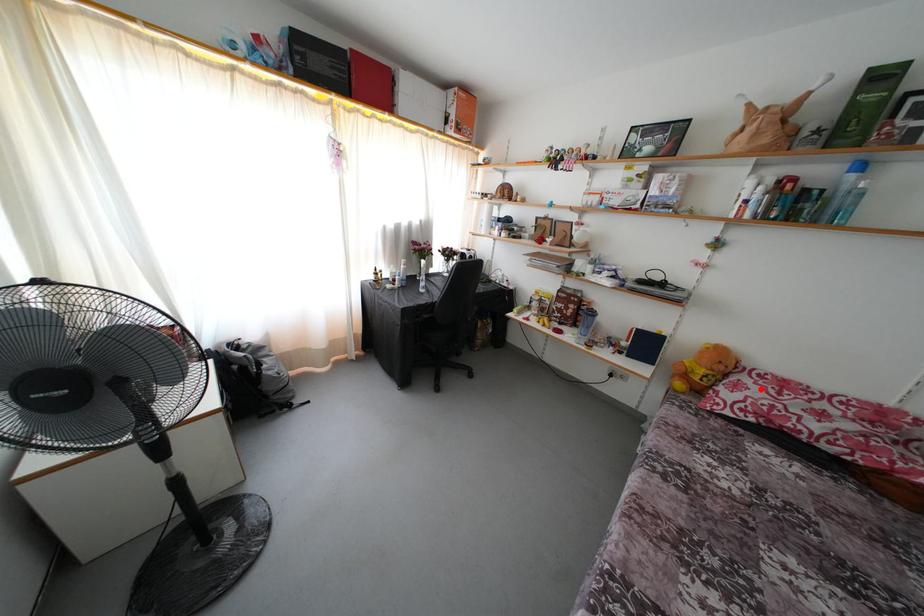
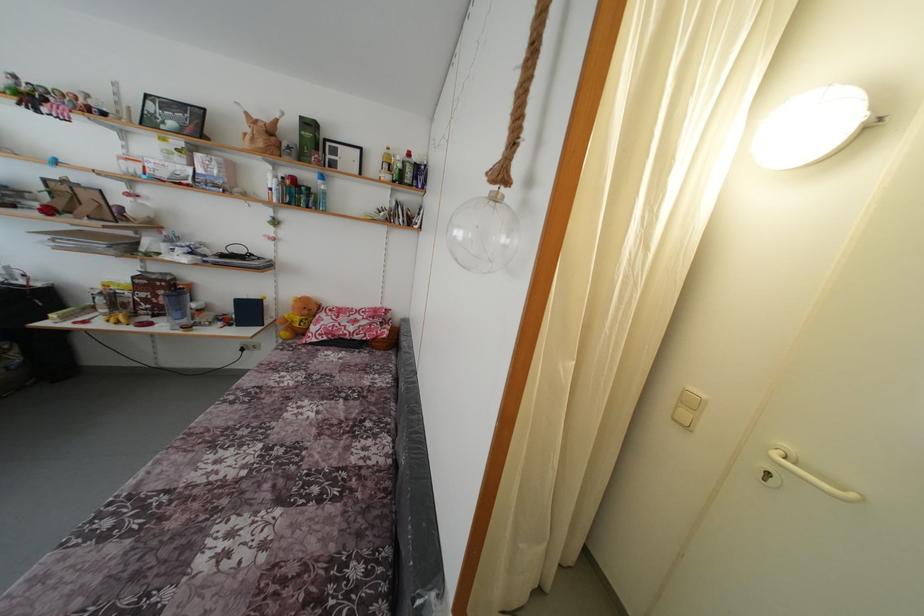
In the second image, find the point that corresponds to the highlighted location in the first image.

(332, 321)